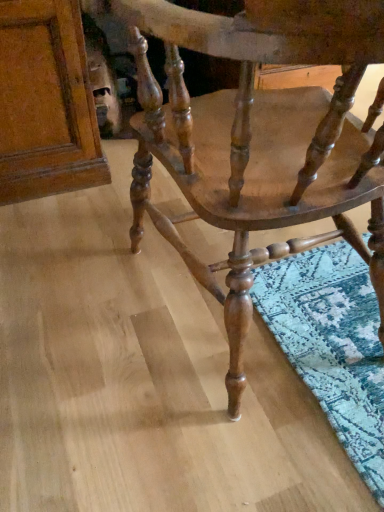
Question: Considering the relative sizes of matte wood cabinet at upper left and wooden chair at center in the image provided, is matte wood cabinet at upper left wider than wooden chair at center?

Choices:
 (A) yes
 (B) no

Answer: (A)

Question: From the image's perspective, would you say matte wood cabinet at upper left is positioned over wooden chair at center?

Choices:
 (A) no
 (B) yes

Answer: (B)

Question: Considering the relative sizes of matte wood cabinet at upper left and wooden chair at center in the image provided, is matte wood cabinet at upper left bigger than wooden chair at center?

Choices:
 (A) yes
 (B) no

Answer: (B)

Question: Is matte wood cabinet at upper left directly adjacent to wooden chair at center?

Choices:
 (A) no
 (B) yes

Answer: (A)

Question: Does matte wood cabinet at upper left turn towards wooden chair at center?

Choices:
 (A) no
 (B) yes

Answer: (B)

Question: Is matte wood cabinet at upper left thinner than wooden chair at center?

Choices:
 (A) yes
 (B) no

Answer: (B)

Question: From a real-world perspective, does wooden chair at center stand above matte wood cabinet at upper left?

Choices:
 (A) no
 (B) yes

Answer: (B)

Question: Would you say matte wood cabinet at upper left is part of wooden chair at center's contents?

Choices:
 (A) yes
 (B) no

Answer: (B)

Question: From the image's perspective, is wooden chair at center under matte wood cabinet at upper left?

Choices:
 (A) no
 (B) yes

Answer: (B)

Question: From a real-world perspective, does wooden chair at center sit lower than matte wood cabinet at upper left?

Choices:
 (A) no
 (B) yes

Answer: (A)

Question: Is wooden chair at center oriented away from matte wood cabinet at upper left?

Choices:
 (A) no
 (B) yes

Answer: (A)

Question: Does wooden chair at center come in front of matte wood cabinet at upper left?

Choices:
 (A) no
 (B) yes

Answer: (B)

Question: Considering the positions of matte wood cabinet at upper left and wooden chair at center in the image, is matte wood cabinet at upper left wider or thinner than wooden chair at center?

Choices:
 (A) wide
 (B) thin

Answer: (A)